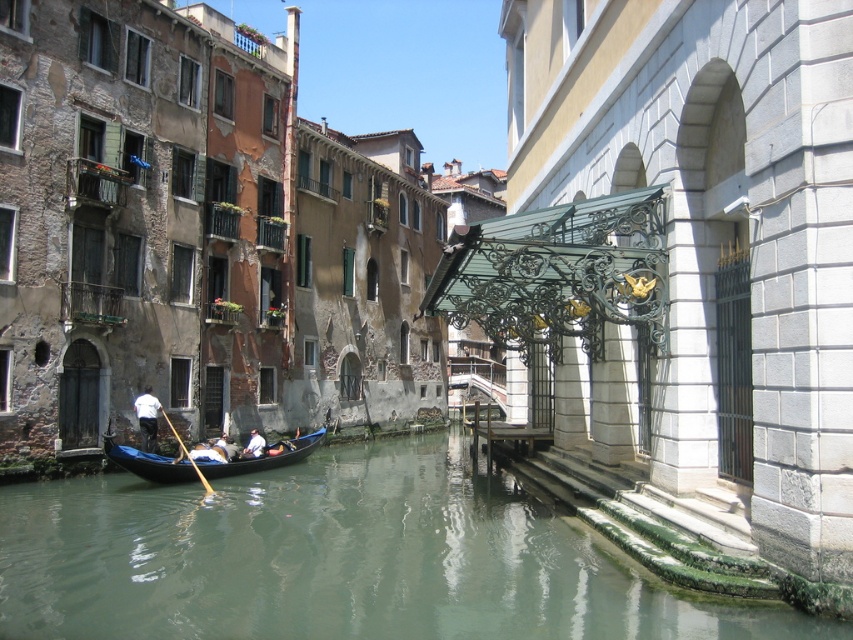
You are a tourist standing on the bridge overlooking the canal. You see the greenish water at lower center and the black polished wood gondola at center. Which object is directly above the other?

The black polished wood gondola at center is directly above the greenish water at lower center because the greenish water at lower center is positioned under it.

You are a tourist standing on the bridge overlooking the canal. You want to take a photo of the black polished wood gondola at center and the greenish water at lower center. How far apart are these two elements in the scene?

The greenish water at lower center and the black polished wood gondola at center are 11.18 meters apart.

You are a tourist standing on the canal bridge and see the greenish water at lower center and the white fabric shirt at lower center. Which object is higher from the water surface?

The greenish water at lower center is taller than the white fabric shirt at lower center, meaning the water is higher than the shirt.